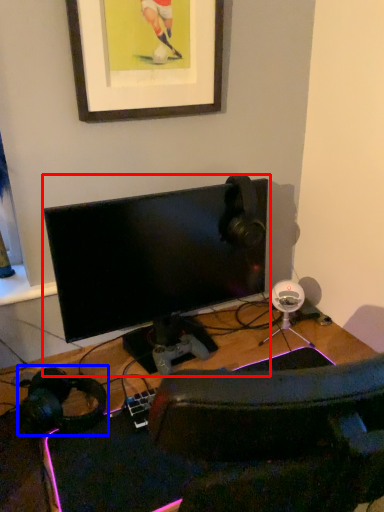
Question: Which object is further to the camera taking this photo, computer monitor (highlighted by a red box) or headphones (highlighted by a blue box)?

Choices:
 (A) computer monitor
 (B) headphones

Answer: (A)